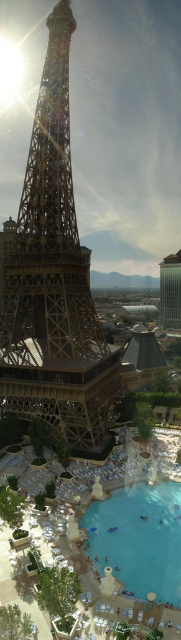
Is golden metallic eiffel tower at center wider than clear blue water at lower center?

Yes.

Is golden metallic eiffel tower at center to the left of clear blue water at lower center from the viewer's perspective?

Yes, golden metallic eiffel tower at center is to the left of clear blue water at lower center.

You are a GUI agent. You are given a task and a screenshot of the screen. Output one action in this format:
    pyautogui.click(x=<x>, y=<y>)
    Task: Click on the golden metallic eiffel tower at center
    
    Given the screenshot: What is the action you would take?
    pyautogui.click(x=53, y=280)

Who is positioned more to the right, clear blue water at lower center or green glass tower at upper center?

green glass tower at upper center is more to the right.

Who is lower down, clear blue water at lower center or green glass tower at upper center?

clear blue water at lower center is below.

Is point (100, 522) closer to viewer compared to point (167, 260)?

That is True.

What are the coordinates of `clear blue water at lower center` in the screenshot? It's located at coord(139,538).

Is point (57, 138) positioned behind point (169, 289)?

No, (57, 138) is in front of (169, 289).

Based on the photo, which is below, golden metallic eiffel tower at center or green glass tower at upper center?

green glass tower at upper center is below.

Find the location of a particular element. The image size is (181, 640). golden metallic eiffel tower at center is located at coordinates click(53, 280).

Locate an element on the screen. golden metallic eiffel tower at center is located at coordinates (53, 280).